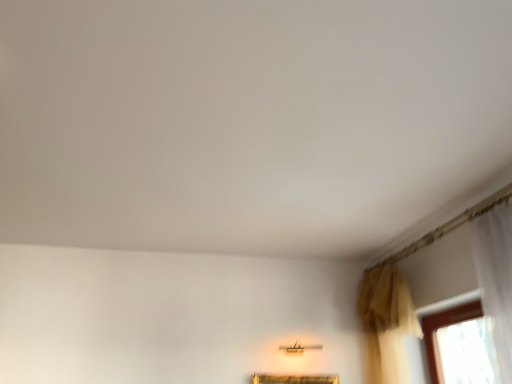
Describe the element at coordinates (298, 349) in the screenshot. I see `matte gold lamp at lower center` at that location.

Locate an element on the screen. The width and height of the screenshot is (512, 384). matte gold lamp at lower center is located at coordinates (298, 349).

At what (x,y) coordinates should I click in order to perform the action: click on matte gold lamp at lower center. Please return your answer as a coordinate pair (x, y). Looking at the image, I should click on (298, 349).